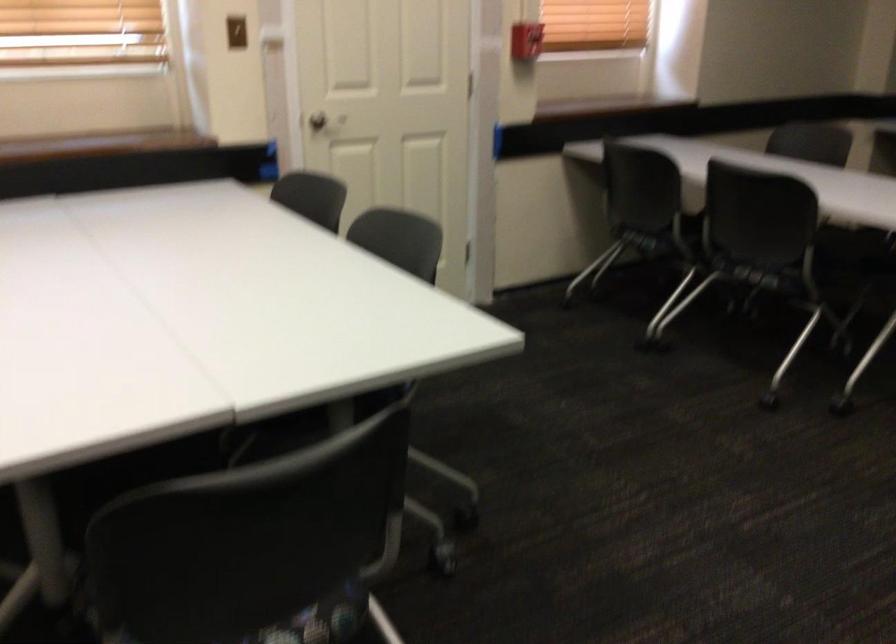
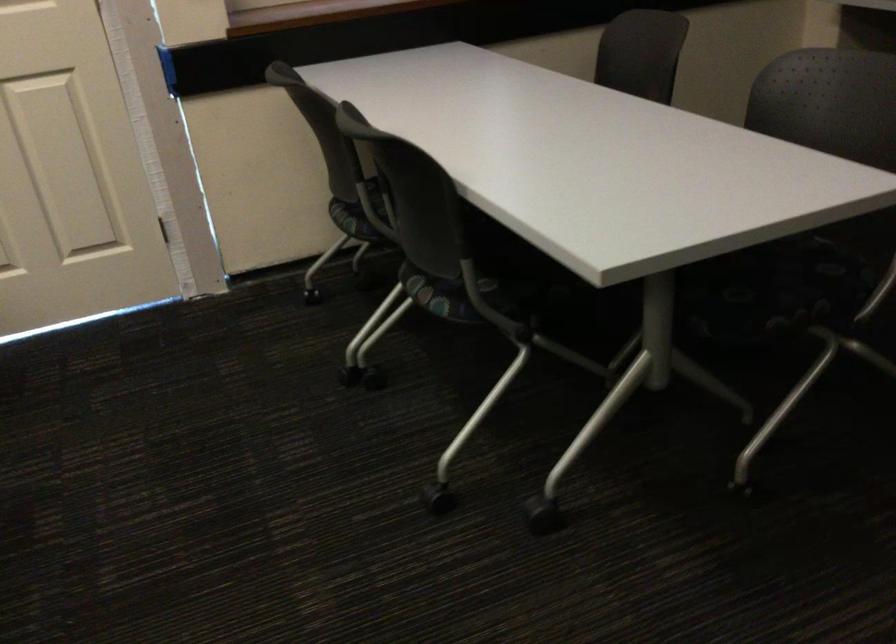
In the second image, find the point that corresponds to (762,270) in the first image.

(442, 295)